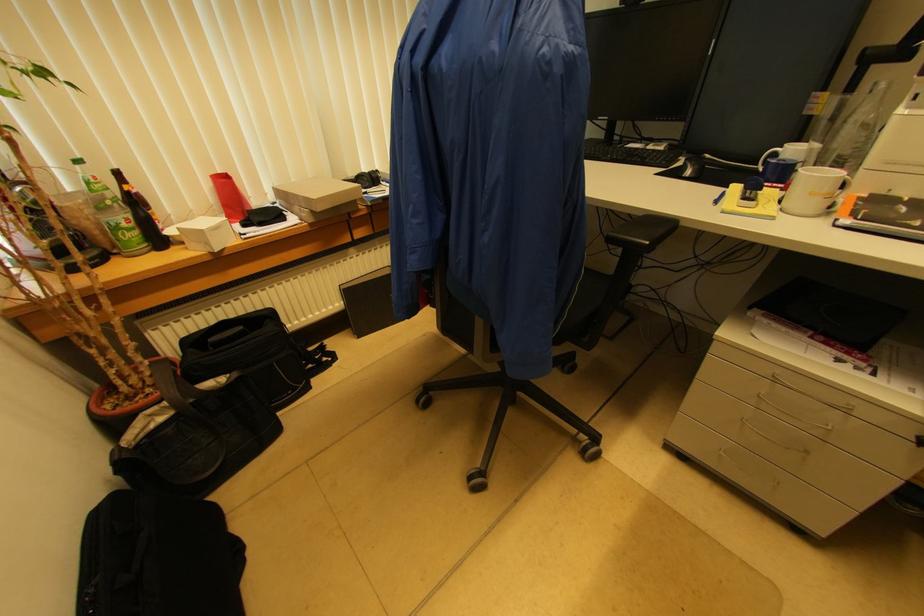
Identify the location of black bag handle. This screenshot has width=924, height=616. (167, 379).